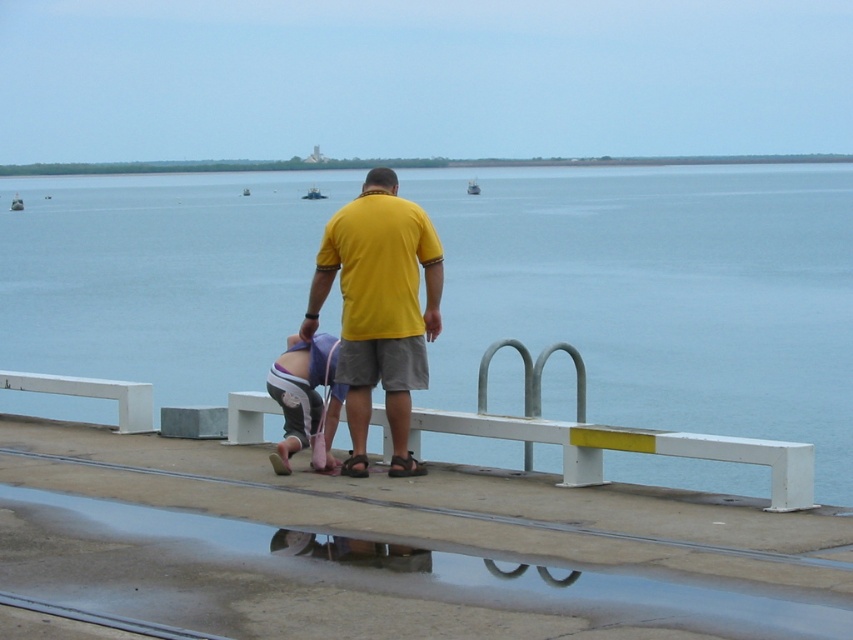
I want to click on blue water at center, so click(660, 292).

Does blue water at center have a lesser height compared to pink fabric diaper at lower center?

No, blue water at center is not shorter than pink fabric diaper at lower center.

In order to click on blue water at center in this screenshot , I will do `click(660, 292)`.

Does point (741, 376) come behind point (422, 369)?

Yes, it is behind point (422, 369).

Which is behind, point (198, 328) or point (351, 435)?

Positioned behind is point (198, 328).

Locate an element on the screen. The width and height of the screenshot is (853, 640). blue water at center is located at coordinates (660, 292).

Who is positioned more to the left, yellow matte shirt at center or pink fabric diaper at lower center?

pink fabric diaper at lower center is more to the left.

Does yellow matte shirt at center have a lesser height compared to pink fabric diaper at lower center?

Incorrect, yellow matte shirt at center's height does not fall short of pink fabric diaper at lower center's.

The width and height of the screenshot is (853, 640). Describe the element at coordinates (379, 308) in the screenshot. I see `yellow matte shirt at center` at that location.

Identify the location of yellow matte shirt at center. This screenshot has height=640, width=853. (379, 308).